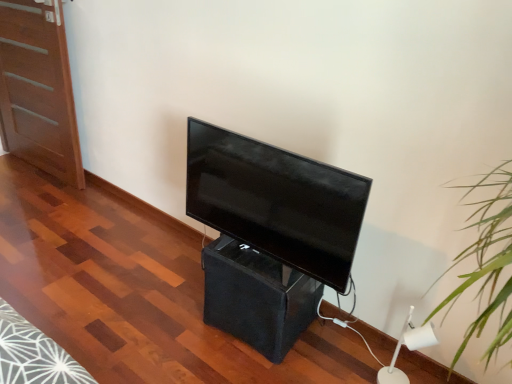
Where is `black fabric speaker at center`? black fabric speaker at center is located at coordinates (257, 297).

The width and height of the screenshot is (512, 384). I want to click on matte wood door at left, so click(38, 89).

Are black fabric speaker at center and white plastic lamp at lower right beside each other?

No.

Considering the relative sizes of black fabric speaker at center and white plastic lamp at lower right in the image provided, is black fabric speaker at center bigger than white plastic lamp at lower right?

Yes.

Measure the distance between black fabric speaker at center and white plastic lamp at lower right.

20.04 inches.

Is point (424, 336) farther from camera compared to point (289, 268)?

Yes.

Is white plastic lamp at lower right outside of black fabric speaker at center?

Absolutely, white plastic lamp at lower right is external to black fabric speaker at center.

Is white plastic lamp at lower right oriented towards black fabric speaker at center?

No, white plastic lamp at lower right is not facing towards black fabric speaker at center.

Consider the image. Considering the relative positions of white plastic lamp at lower right and black fabric speaker at center in the image provided, is white plastic lamp at lower right to the left of black fabric speaker at center from the viewer's perspective?

No, white plastic lamp at lower right is not to the left of black fabric speaker at center.

How many degrees apart are the facing directions of matte black tv at center and black fabric speaker at center?

They differ by 0.000879 degrees in their facing directions.

Would you consider matte black tv at center to be distant from black fabric speaker at center?

No, matte black tv at center is in close proximity to black fabric speaker at center.

Could you tell me if matte black tv at center is turned towards black fabric speaker at center?

No.

Is the position of matte black tv at center more distant than that of black fabric speaker at center?

No, it is in front of black fabric speaker at center.

From the image's perspective, is black fabric speaker at center on matte wood door at left?

No, from the image's perspective, black fabric speaker at center is not on top of matte wood door at left.

Is black fabric speaker at center positioned beyond the bounds of matte wood door at left?

black fabric speaker at center lies outside matte wood door at left's area.

Considering the points (234, 272) and (80, 154), which point is in front, point (234, 272) or point (80, 154)?

The point (234, 272) is closer.

Does black fabric speaker at center have a greater width compared to matte wood door at left?

Correct, the width of black fabric speaker at center exceeds that of matte wood door at left.

What's the angular difference between matte black tv at center and matte wood door at left's facing directions?

There is a 1.87-degree angle between the facing directions of matte black tv at center and matte wood door at left.

Does matte black tv at center touch matte wood door at left?

No, matte black tv at center is not next to matte wood door at left.

Locate an element on the screen. This screenshot has height=384, width=512. television in front of the matte wood door at left is located at coordinates (276, 201).

Considering the relative sizes of matte black tv at center and matte wood door at left in the image provided, is matte black tv at center shorter than matte wood door at left?

Indeed, matte black tv at center has a lesser height compared to matte wood door at left.

Is black fabric speaker at center shorter than matte black tv at center?

Yes, black fabric speaker at center is shorter than matte black tv at center.

Are black fabric speaker at center and matte black tv at center making contact?

No, black fabric speaker at center is not making contact with matte black tv at center.

Is black fabric speaker at center in front of matte black tv at center?

No, it is not.

In the scene shown: Is black fabric speaker at center looking in the opposite direction of matte black tv at center?

No.

Can you confirm if matte wood door at left is smaller than black fabric speaker at center?

No.

From the image's perspective, is matte wood door at left on top of black fabric speaker at center?

Yes, from the image's perspective, matte wood door at left is on top of black fabric speaker at center.

In order to click on table in front of the matte wood door at left in this screenshot , I will do [257, 297].

Locate an element on the screen. table behind the white plastic lamp at lower right is located at coordinates (257, 297).

Identify the location of table on the left of the white plastic lamp at lower right. The image size is (512, 384). (257, 297).

Estimate the real-world distances between objects in this image. Which object is closer to matte wood door at left, black fabric speaker at center or white plastic lamp at lower right?

The object closer to matte wood door at left is black fabric speaker at center.

Estimate the real-world distances between objects in this image. Which object is further from matte wood door at left, black fabric speaker at center or matte black tv at center?

black fabric speaker at center is further to matte wood door at left.

Based on their spatial positions, is matte black tv at center or matte wood door at left closer to black fabric speaker at center?

matte black tv at center.

From the image, which object appears to be farther from white plastic lamp at lower right, black fabric speaker at center or matte wood door at left?

The object further to white plastic lamp at lower right is matte wood door at left.

Based on their spatial positions, is matte black tv at center or matte wood door at left further from white plastic lamp at lower right?

matte wood door at left.

Which object lies further to the anchor point black fabric speaker at center, matte wood door at left or matte black tv at center?

Based on the image, matte wood door at left appears to be further to black fabric speaker at center.

When comparing their distances from black fabric speaker at center, does white plastic lamp at lower right or matte wood door at left seem closer?

white plastic lamp at lower right lies closer to black fabric speaker at center than the other object.

Considering their positions, is white plastic lamp at lower right positioned further to matte black tv at center than black fabric speaker at center?

white plastic lamp at lower right is further to matte black tv at center.

You are a GUI agent. You are given a task and a screenshot of the screen. Output one action in this format:
    pyautogui.click(x=<x>, y=<y>)
    Task: Click on the table between matte wood door at left and white plastic lamp at lower right
    Image resolution: width=512 pixels, height=384 pixels.
    Given the screenshot: What is the action you would take?
    pyautogui.click(x=257, y=297)

At what (x,y) coordinates should I click in order to perform the action: click on table between matte black tv at center and white plastic lamp at lower right in the horizontal direction. Please return your answer as a coordinate pair (x, y). The height and width of the screenshot is (384, 512). Looking at the image, I should click on (257, 297).

Find the location of `television between matte wood door at left and white plastic lamp at lower right from left to right`. television between matte wood door at left and white plastic lamp at lower right from left to right is located at coordinates (276, 201).

Where is `television situated between matte wood door at left and black fabric speaker at center from left to right`? This screenshot has height=384, width=512. television situated between matte wood door at left and black fabric speaker at center from left to right is located at coordinates (276, 201).